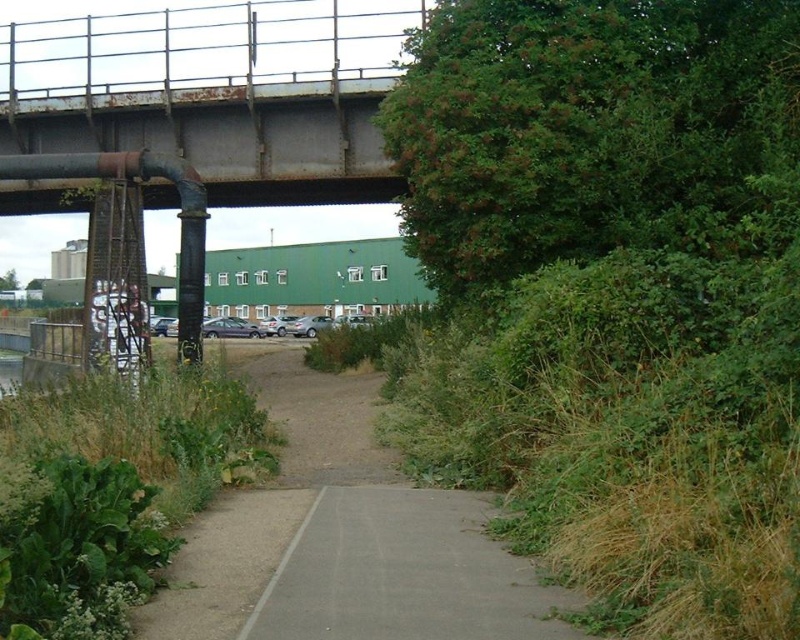
You are standing at the start of the paved pathway in the urban scene. You want to reach the green leafy bush at upper right. Based on the distance provided, can you estimate how many steps it would take to walk there if each of your steps is about 2.5 feet long?

Result: The green leafy bush at upper right is 15.92 feet away from the viewer. If each step is approximately 2.5 feet, dividing the distance by step length gives roughly 6.37 steps. Since you can only take whole steps, it would take about 6 to 7 steps to reach the green leafy bush at upper right.

You are a pedestrian trying to cross the rusty metal bridge at upper center. There is a green leafy bush at upper right blocking your path. Can you walk around it on the left side?

The green leafy bush at upper right is to the right of the rusty metal bridge at upper center, so you can walk around it on the left side.

You are a delivery person trying to decide whether to take the dull gray concrete path at center or the rusty metal bridge at upper center for your delivery route. Which path is wider and more suitable for a delivery vehicle?

The rusty metal bridge at upper center is wider than the dull gray concrete path at center, making it more suitable for a delivery vehicle.